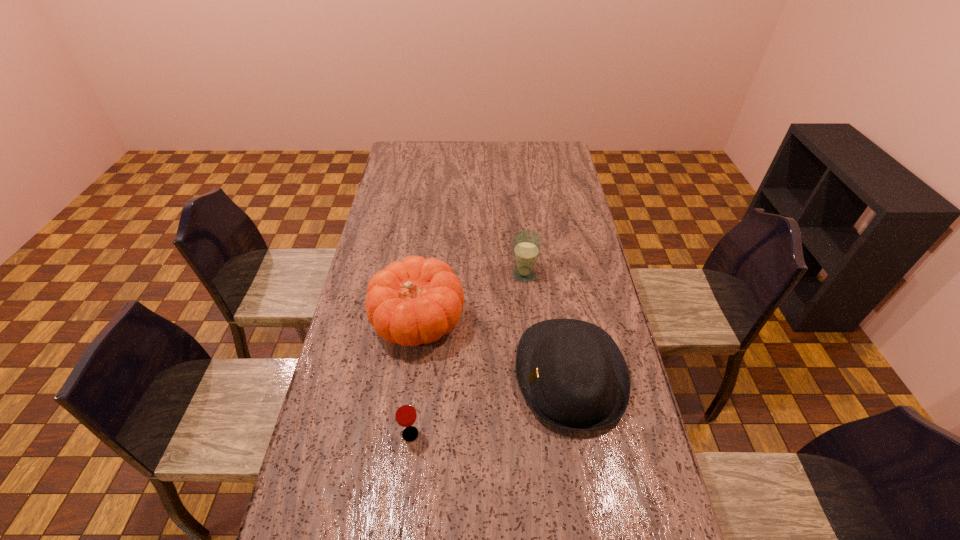
You are a GUI agent. You are given a task and a screenshot of the screen. Output one action in this format:
    pyautogui.click(x=<x>, y=<y>)
    Task: Click on the vacant point that satisfies the following two spatial constraints: 1. on the front-facing side of the fedora; 2. on the front side of the left glass
    
    Given the screenshot: What is the action you would take?
    pyautogui.click(x=580, y=434)

In order to click on vacant space that satisfies the following two spatial constraints: 1. on the back side of the farthest object; 2. on the right side of the pumpkin in this screenshot , I will do `click(425, 274)`.

Find the location of a particular element. The image size is (960, 540). free location that satisfies the following two spatial constraints: 1. on the front-facing side of the fedora; 2. on the front side of the shorter glass is located at coordinates (580, 434).